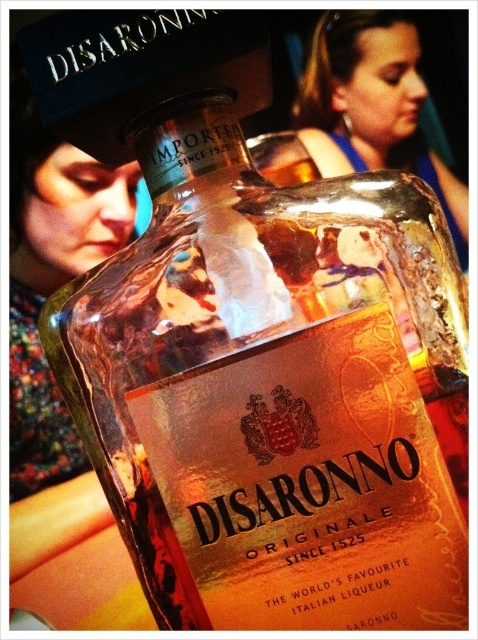
You are an observer looking at the bottle of Disaronno Originale. You notice two accessories in the background. Which accessory is nearer to you between the matte black hat at upper left and the blue fabric hairband at upper center?

The matte black hat at upper left is closer to the viewer than the blue fabric hairband at upper center.

You are a photographer setting up a shoot for a Disaronno Originale advertisement. You need to ensure that the two accessories in the background, the matte black hat at upper left and the blue fabric hairband at upper center, are positioned in a way that they don not distract from the bottle. Considering their sizes, which accessory should be placed closer to the bottle to maintain focus on the liqueur?

The matte black hat at upper left is thinner than the blue fabric hairband at upper center, so placing the thinner matte black hat at upper left closer to the bottle would help keep the focus on the Disaronno Originale since smaller objects are less likely to distract when positioned nearer.

Consider the image. You are a photographer setting up a shoot for a fashion magazine. You have to decide whether to place a matte black hat at upper left or a blue fabric hairband at upper center closer to the camera. Based on their positions in the image, which object should you choose to ensure it appears larger in the final photo?

The matte black hat at upper left is taller than the blue fabric hairband at upper center, so placing the matte black hat at upper left closer to the camera will make it appear larger in the photo.